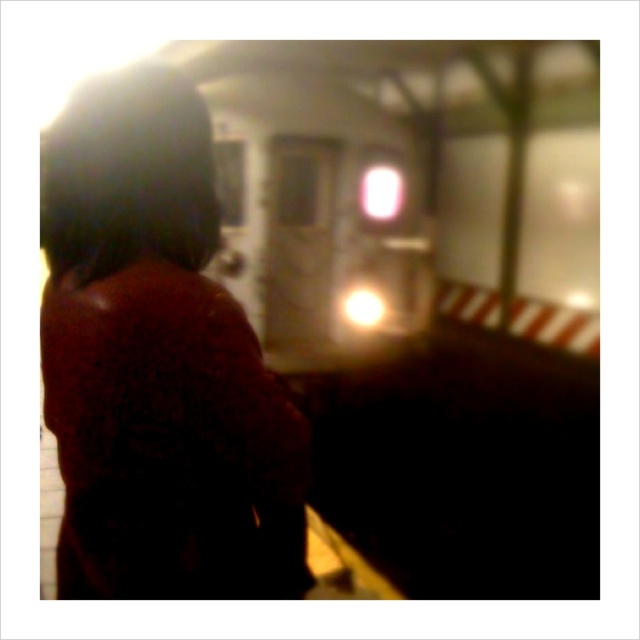
You are a passenger at the subway station and want to board the metallic silver train at center. There is a person wearing a dark brown fur coat at upper left blocking your path. Can you safely walk around them to reach the train before it departs?

The dark brown fur coat at upper left is 13.89 feet away from the metallic silver train at center. Since the distance between them is sufficient, you can safely walk around the person wearing the dark brown fur coat at upper left to reach the metallic silver train at center before it departs.

You are a photographer trying to capture a clear shot of the metallic silver train at center. You notice the dark brown fur coat at upper left in your frame. Considering their sizes in the image, which object will appear larger in your photo?

The metallic silver train at center appears larger in the photo than the dark brown fur coat at upper left because the train is larger in size according to the description.